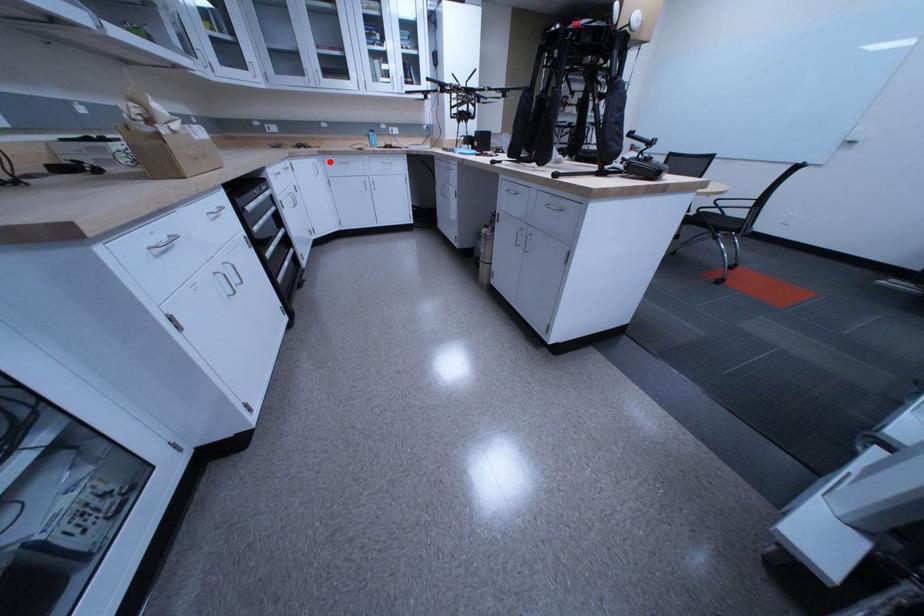
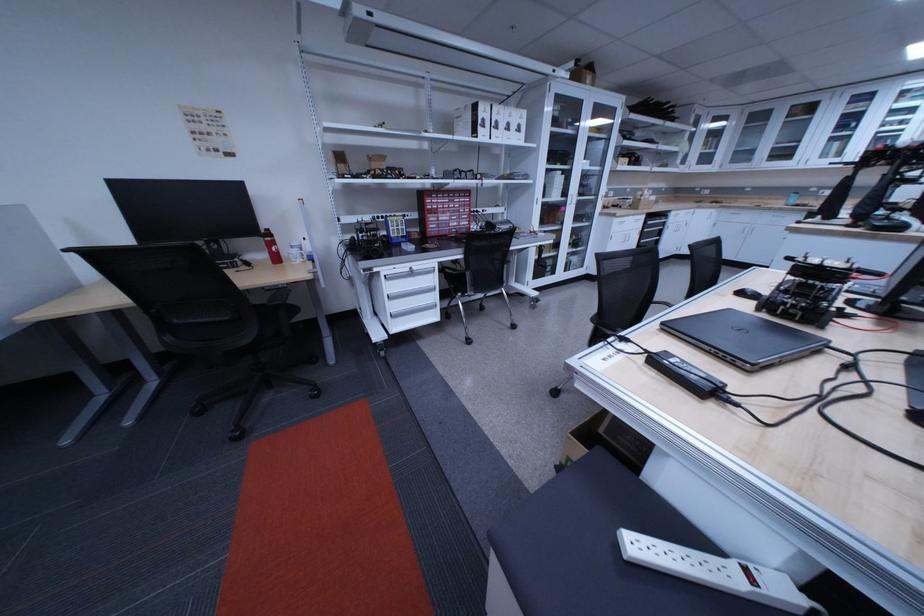
Question: I am providing you with two images of the same scene from different viewpoints. Given a red point in image1, look at the same physical point in image2. Is it:

Choices:
 (A) Closer to the viewpoint
 (B) Farther from the viewpoint

Answer: (B)